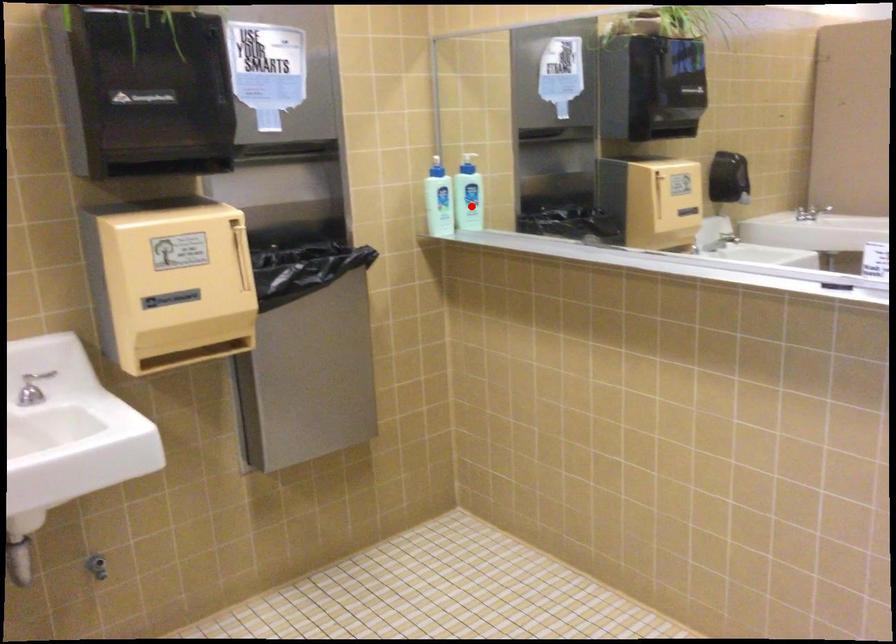
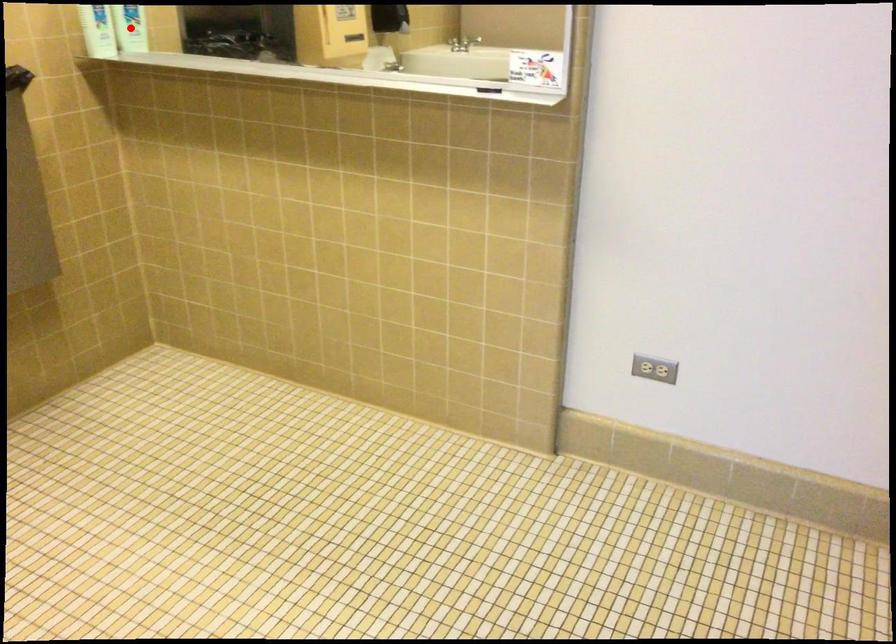
I am providing you with two images of the same scene from different viewpoints. A red point is marked on the first image and another point is marked on the second image. Do the highlighted points in image1 and image2 indicate the same real-world spot?

Yes